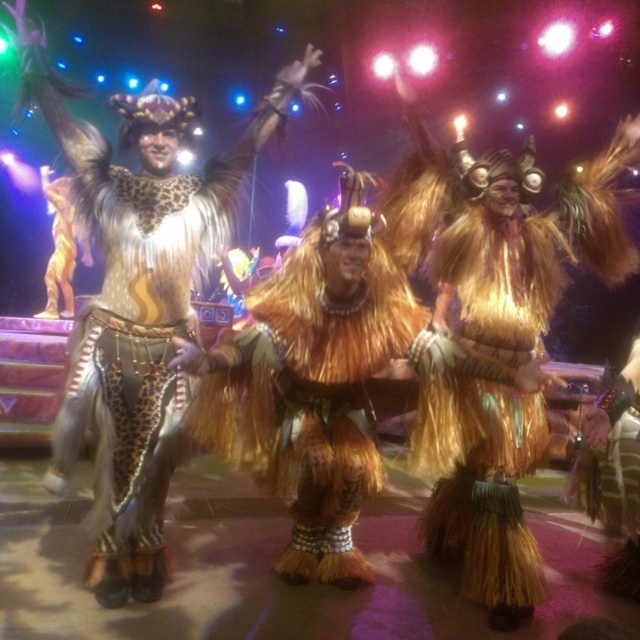
Question: Is leather fur coat at center wider than fuzzy brown fur at center?

Choices:
 (A) yes
 (B) no

Answer: (A)

Question: Which is nearer to the fuzzy brown fur at center?

Choices:
 (A) leopard print fur vest at center
 (B) fuzzy golden skirt at center

Answer: (A)

Question: Which of these objects is positioned closest to the leather fur coat at center?

Choices:
 (A) leopard print fur vest at center
 (B) fuzzy brown fur at center
 (C) fuzzy golden skirt at center

Answer: (A)

Question: Estimate the real-world distances between objects in this image. Which object is farther from the leopard print fur vest at center?

Choices:
 (A) leather fur coat at center
 (B) fuzzy brown fur at center

Answer: (B)

Question: Can you confirm if fuzzy brown fur at center is positioned to the right of leopard print fur vest at center?

Choices:
 (A) no
 (B) yes

Answer: (B)

Question: Observing the image, what is the correct spatial positioning of fuzzy brown fur at center in reference to fuzzy golden skirt at center?

Choices:
 (A) left
 (B) right

Answer: (A)